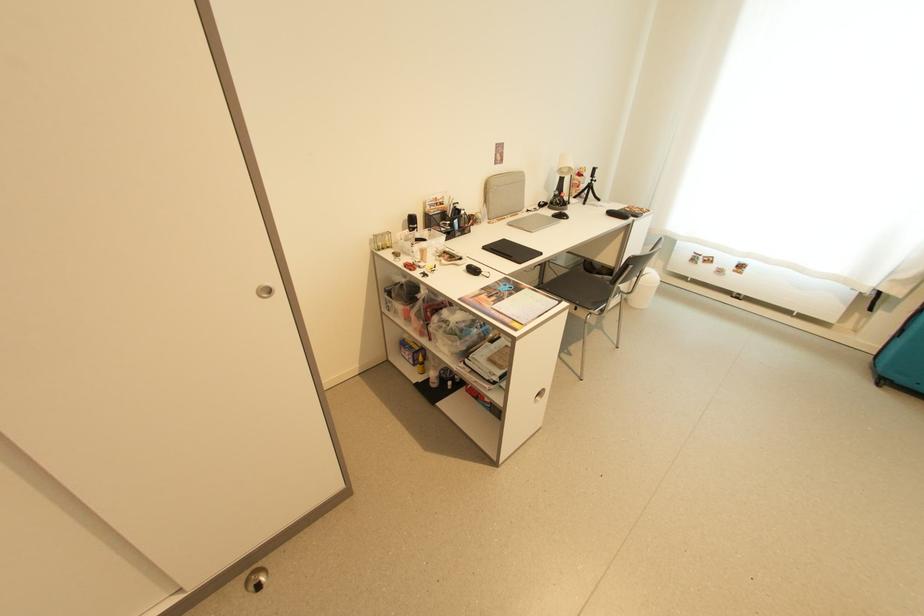
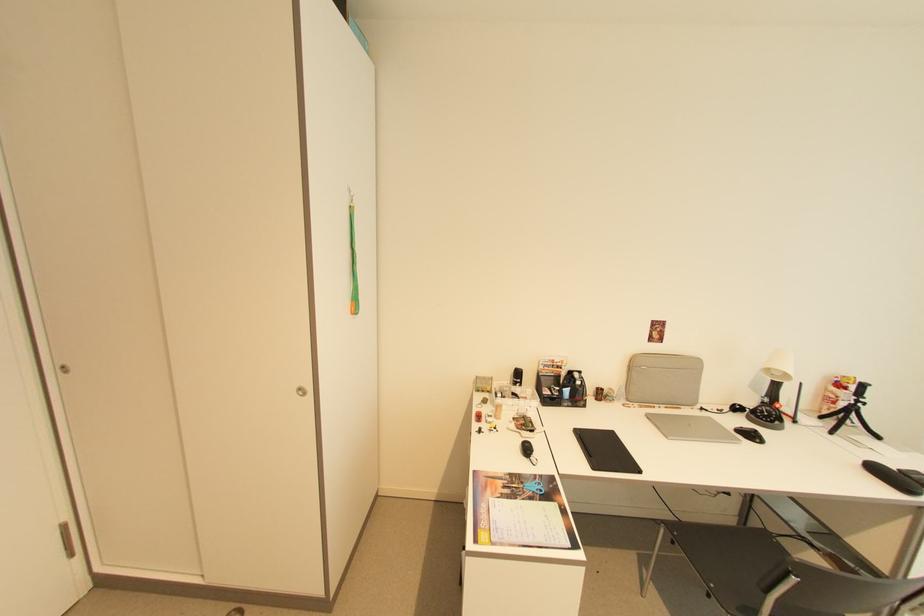
Where in the second image is the point corresponding to the point at 489,298 from the first image?

(505, 484)